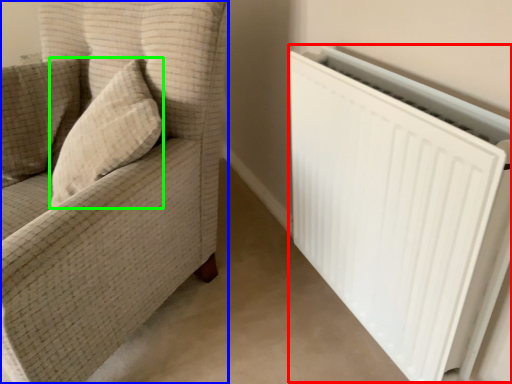
Question: Estimate the real-world distances between objects in this image. Which object is farther from radiator (highlighted by a red box), furniture (highlighted by a blue box) or throw pillow (highlighted by a green box)?

Choices:
 (A) furniture
 (B) throw pillow

Answer: (B)